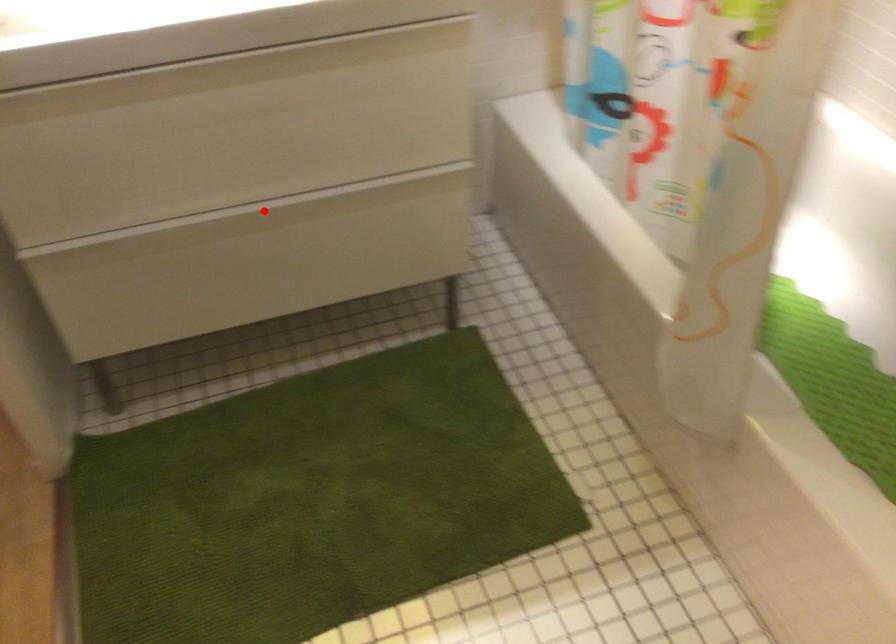
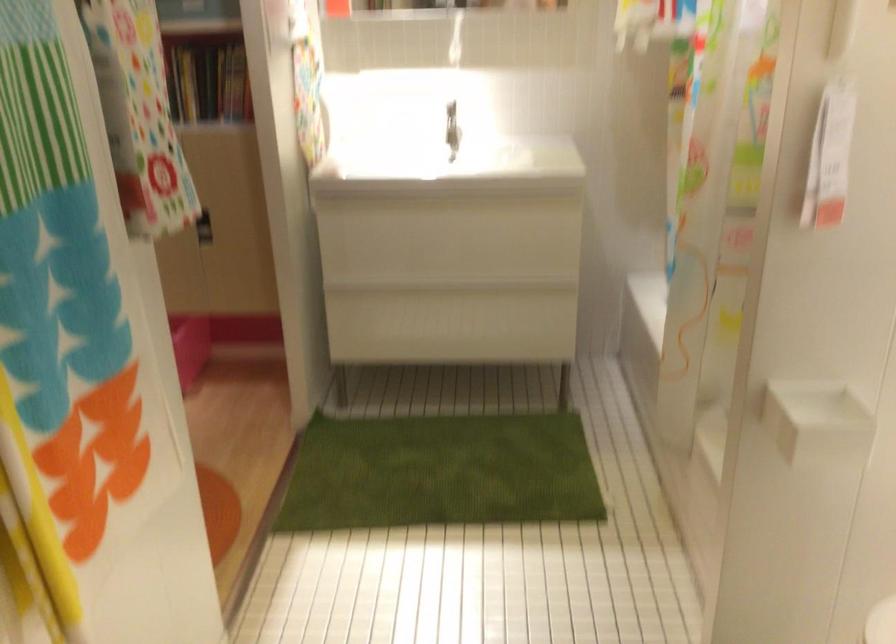
Locate, in the second image, the point that corresponds to the highlighted location in the first image.

(453, 288)